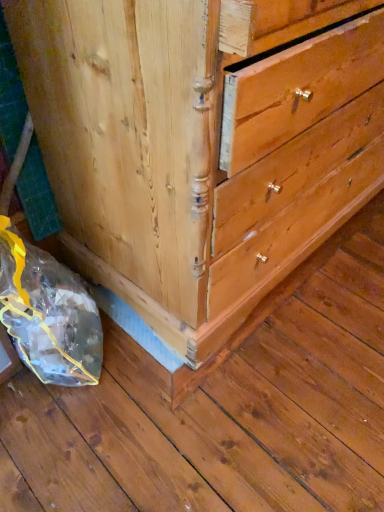
Measure the distance between point (x=96, y=373) and camera.

Point (x=96, y=373) is 3.51 feet from camera.

Locate an element on the screen. The width and height of the screenshot is (384, 512). clear plastic bag at lower left is located at coordinates (48, 314).

What do you see at coordinates (48, 314) in the screenshot? The width and height of the screenshot is (384, 512). I see `clear plastic bag at lower left` at bounding box center [48, 314].

Identify the location of clear plastic bag at lower left. The image size is (384, 512). (48, 314).